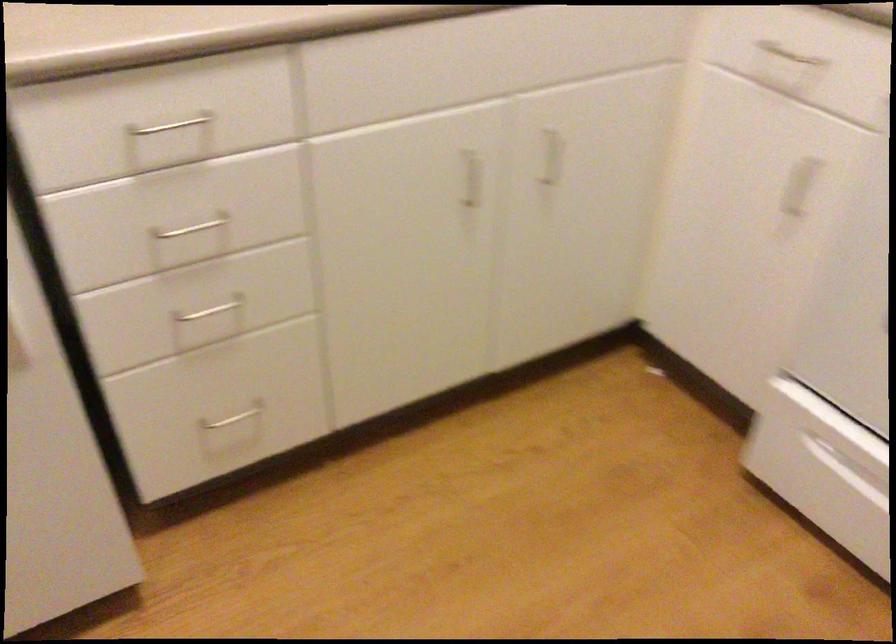
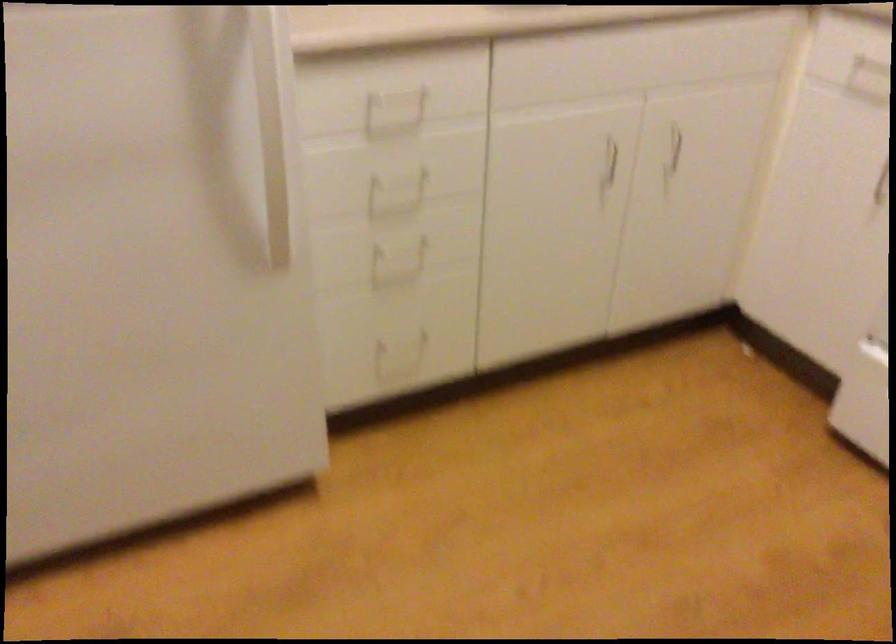
Locate, in the second image, the point that corresponds to the point at 224,303 in the first image.

(407, 245)